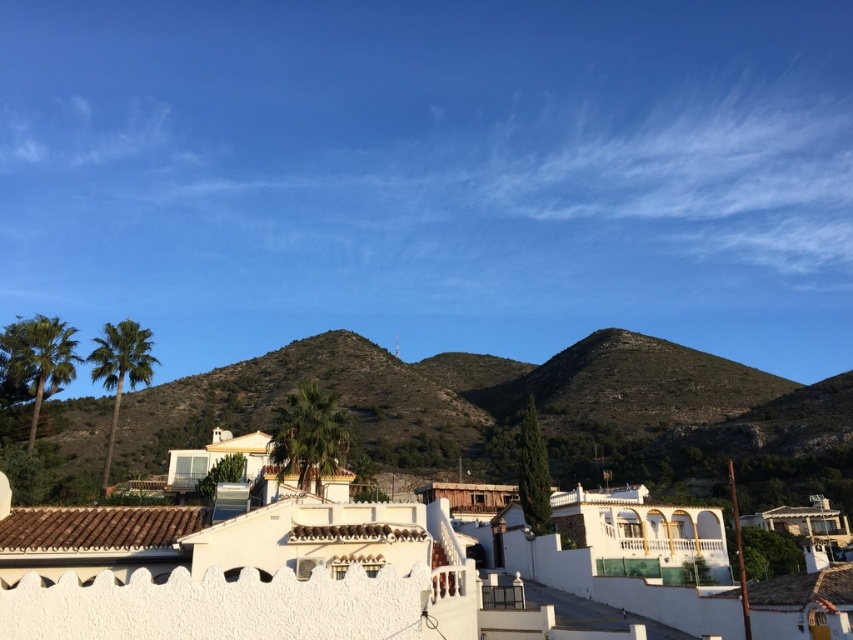
Can you confirm if green textured hillside at center is positioned above green leafy palm at left?

Correct, green textured hillside at center is located above green leafy palm at left.

Does point (556, 408) lie behind point (119, 346)?

Yes, it is behind point (119, 346).

Identify the location of green textured hillside at center. The height and width of the screenshot is (640, 853). (521, 410).

Does green leafy palm tree at left have a lesser height compared to green leafy palm at left?

Correct, green leafy palm tree at left is not as tall as green leafy palm at left.

Who is more forward, (x=33, y=326) or (x=149, y=346)?

Point (x=33, y=326) is more forward.

This screenshot has width=853, height=640. Identify the location of green leafy palm tree at left. (39, 358).

How much distance is there between green textured hillside at center and green leafy palm tree at center?

They are 144.79 meters apart.

Who is positioned more to the left, green textured hillside at center or green leafy palm tree at center?

green leafy palm tree at center

Describe the element at coordinates (521, 410) in the screenshot. The height and width of the screenshot is (640, 853). I see `green textured hillside at center` at that location.

Identify the location of green textured hillside at center. (521, 410).